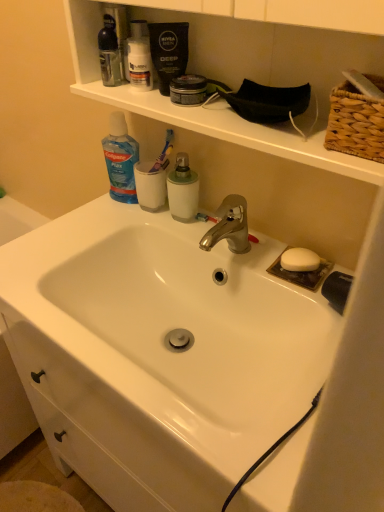
Where is `free location in front of red plastic toothbrush at center, which is the 2th toothbrush from top to bottom`? The image size is (384, 512). free location in front of red plastic toothbrush at center, which is the 2th toothbrush from top to bottom is located at coordinates (250, 264).